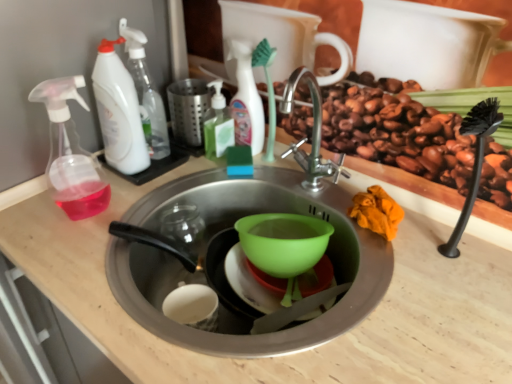
Where is `vacant area located to the right-hand side of transparent plastic spray bottle at left`? vacant area located to the right-hand side of transparent plastic spray bottle at left is located at coordinates (154, 194).